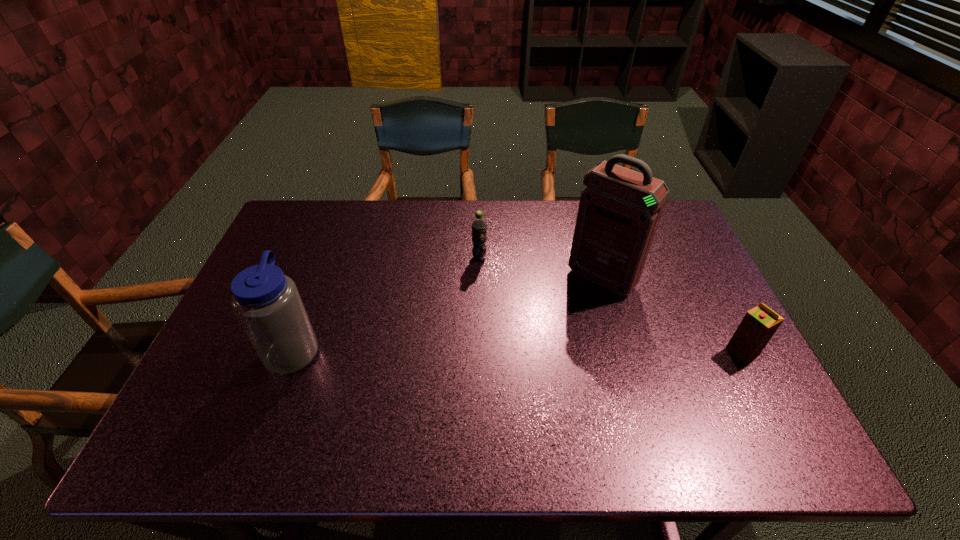
Find the location of a particular element. Image resolution: width=960 pixels, height=540 pixels. vacant region located on the front label of the third object from right to left is located at coordinates (491, 341).

At what (x,y) coordinates should I click in order to perform the action: click on vacant space located 0.180m on the front-facing side of the first-aid kit. Please return your answer as a coordinate pair (x, y). This screenshot has width=960, height=540. Looking at the image, I should click on (550, 334).

Find the location of a particular element. This screenshot has height=540, width=960. vacant space situated on the front-facing side of the first-aid kit is located at coordinates (546, 339).

The height and width of the screenshot is (540, 960). I want to click on vacant point located on the front-facing side of the first-aid kit, so click(574, 308).

Locate an element on the screen. This screenshot has height=540, width=960. object positioned at the left edge is located at coordinates (266, 302).

Identify the location of object located in the right edge section of the desktop. (759, 324).

Find the location of `vacant space at the far edge`. vacant space at the far edge is located at coordinates (535, 227).

This screenshot has height=540, width=960. What are the coordinates of `vacant space at the near edge` in the screenshot? It's located at coord(546,392).

In the image, there is a desktop. What are the coordinates of `free space at the right edge` in the screenshot? It's located at (713, 291).

The image size is (960, 540). Find the location of `free space at the far left corner`. free space at the far left corner is located at coordinates (329, 223).